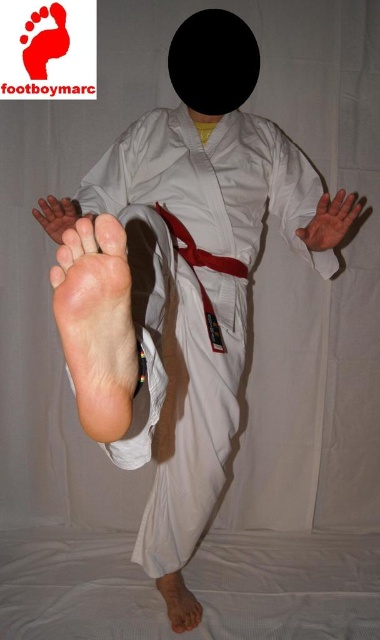
Can you confirm if white cotton kimono at center is bigger than pale skin foot at center?

Yes, white cotton kimono at center is bigger than pale skin foot at center.

Does white cotton kimono at center appear on the right side of pale skin foot at center?

Yes, white cotton kimono at center is to the right of pale skin foot at center.

Is point (305, 157) positioned after point (82, 228)?

Yes, it is behind point (82, 228).

At what (x,y) coordinates should I click in order to perform the action: click on white cotton kimono at center. Please return your answer as a coordinate pair (x, y). Image resolution: width=380 pixels, height=640 pixels. Looking at the image, I should click on (194, 296).

Is white cotton kimono at center further to camera compared to pinkish matte skin at lower center?

No, it is not.

Is white cotton kimono at center wider than pinkish matte skin at lower center?

Correct, the width of white cotton kimono at center exceeds that of pinkish matte skin at lower center.

Does point (129, 468) come in front of point (175, 572)?

Yes.

Image resolution: width=380 pixels, height=640 pixels. In order to click on white cotton kimono at center in this screenshot , I will do `click(194, 296)`.

Is pale skin foot at center below pinkish matte skin at lower center?

No.

Is pale skin foot at center thinner than pinkish matte skin at lower center?

Indeed, pale skin foot at center has a lesser width compared to pinkish matte skin at lower center.

Find the location of a particular element. pale skin foot at center is located at coordinates (96, 323).

Where is `pale skin foot at center`? This screenshot has height=640, width=380. pale skin foot at center is located at coordinates (96, 323).